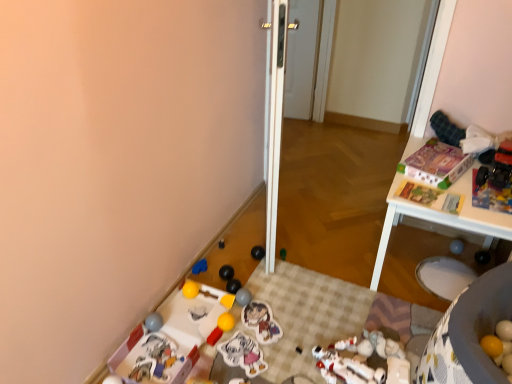
I want to click on spots to the right of matte gray ball at center, which ranks as the 10th toy in right-to-left order, so click(x=279, y=306).